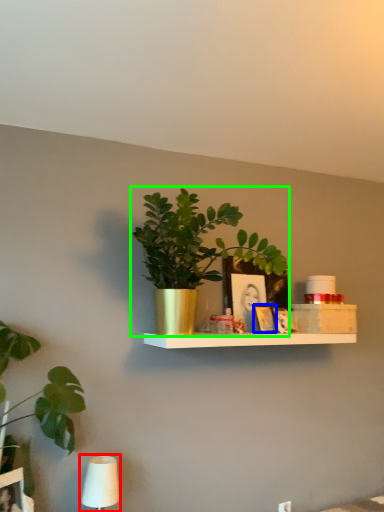
Question: Based on their relative distances, which object is nearer to table lamp (highlighted by a red box)? Choose from picture frame (highlighted by a blue box) and houseplant (highlighted by a green box).

Choices:
 (A) picture frame
 (B) houseplant

Answer: (B)